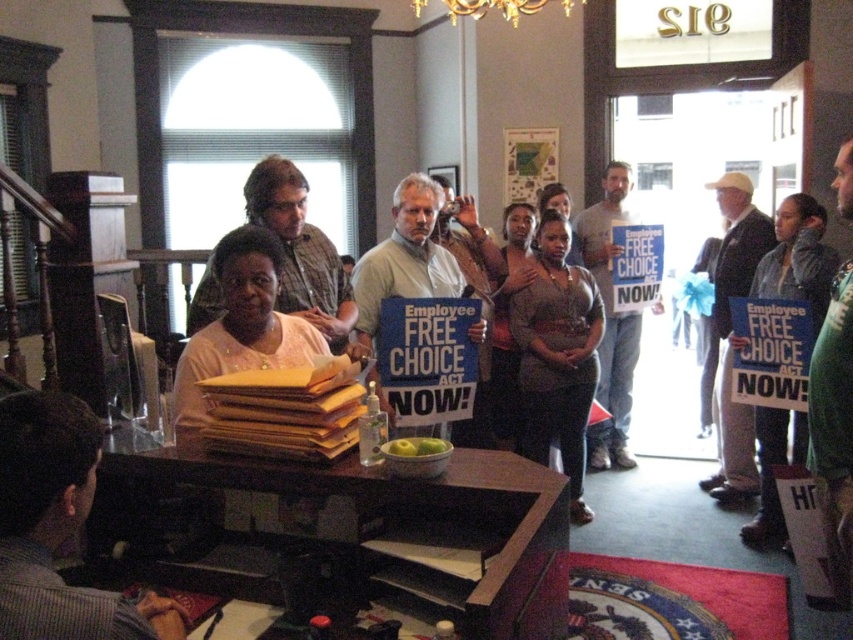
Which is in front, point (207, 477) or point (80, 467)?

Point (80, 467) is more forward.

Can you confirm if brown wood table at lower center is positioned to the right of dark gray striped shirt at lower left?

Indeed, brown wood table at lower center is positioned on the right side of dark gray striped shirt at lower left.

Is point (227, 458) more distant than point (38, 577)?

Yes, it is behind point (38, 577).

The width and height of the screenshot is (853, 640). In order to click on brown wood table at lower center in this screenshot , I will do `click(368, 522)`.

Measure the distance between green fabric jacket at center and matte blue sign at center.

The distance of green fabric jacket at center from matte blue sign at center is 4.70 feet.

Is green fabric jacket at center to the right of matte blue sign at center from the viewer's perspective?

Yes, green fabric jacket at center is to the right of matte blue sign at center.

You are a GUI agent. You are given a task and a screenshot of the screen. Output one action in this format:
    pyautogui.click(x=<x>, y=<y>)
    Task: Click on the green fabric jacket at center
    The height and width of the screenshot is (640, 853).
    Given the screenshot: What is the action you would take?
    pyautogui.click(x=798, y=259)

You are a GUI agent. You are given a task and a screenshot of the screen. Output one action in this format:
    pyautogui.click(x=<x>, y=<y>)
    Task: Click on the green fabric jacket at center
    
    Given the screenshot: What is the action you would take?
    pyautogui.click(x=798, y=259)

Does point (567, 333) come closer to viewer compared to point (781, 449)?

No, it is not.

The height and width of the screenshot is (640, 853). I want to click on matte brown shirt at center, so click(556, 355).

This screenshot has width=853, height=640. I want to click on matte brown shirt at center, so pos(556,355).